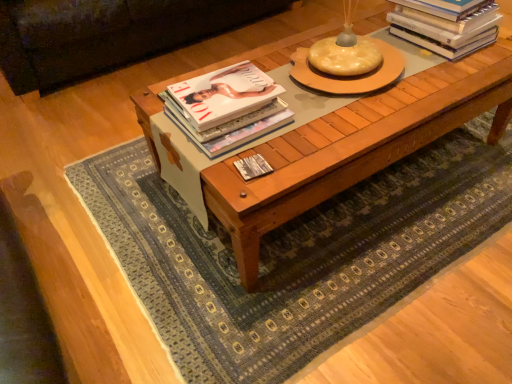
This screenshot has height=384, width=512. I want to click on vacant space positioned to the left of hardcover books at upper right, acting as the 3th book starting from the left, so click(x=365, y=34).